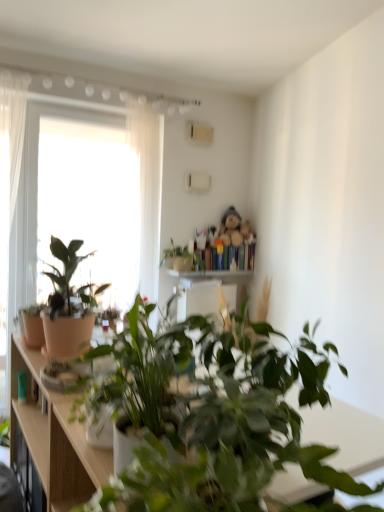
At what (x,y) coordinates should I click in order to perform the action: click on free point below wooden bookshelf at upper center (from a real-world perspective). Please return your answer as a coordinate pair (x, y). Looking at the image, I should click on (233, 274).